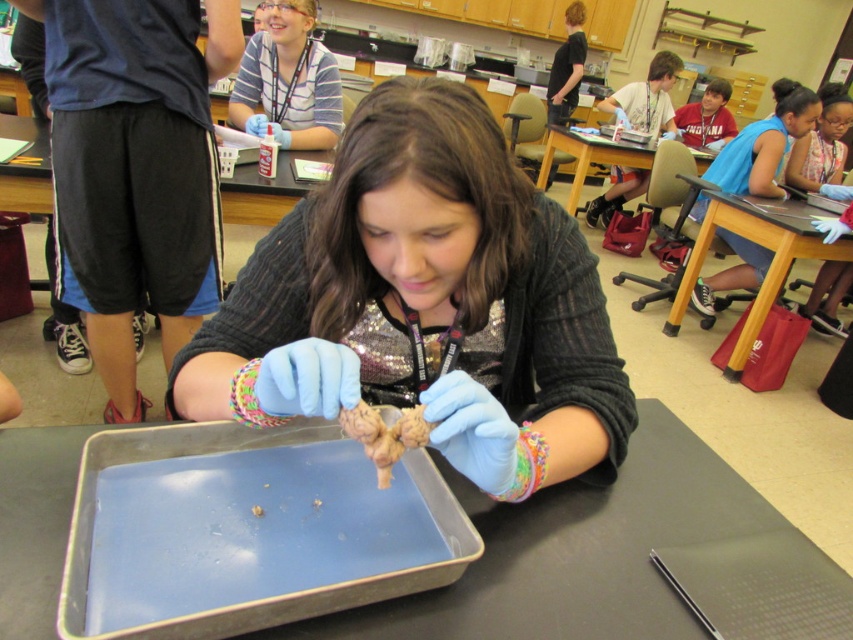
You are a student in the classroom and want to reach both the point at coordinates point (474, 250) and the point at coordinates point (537, 182). Which point should you reach for first?

You should reach for point (474, 250) first because it is closer to you than point (537, 182).

You are a student in the classroom and need to place the brown textured root vegetable at center on top of the blue plastic tray at center. Will it fit based on their sizes?

The blue plastic tray at center has a greater height compared to brown textured root vegetable at center, so yes, the brown textured root vegetable at center can be placed on top of the blue plastic tray at center since it is shorter than the tray.